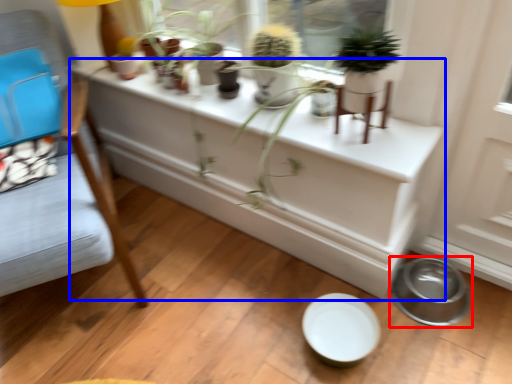
Question: Which of the following is the farthest to the observer, bowl (highlighted by a red box) or table (highlighted by a blue box)?

Choices:
 (A) bowl
 (B) table

Answer: (B)